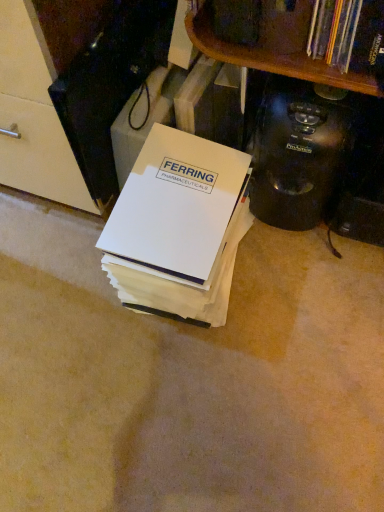
Locate an element on the screen. vacant space in front of white paper at center is located at coordinates (185, 382).